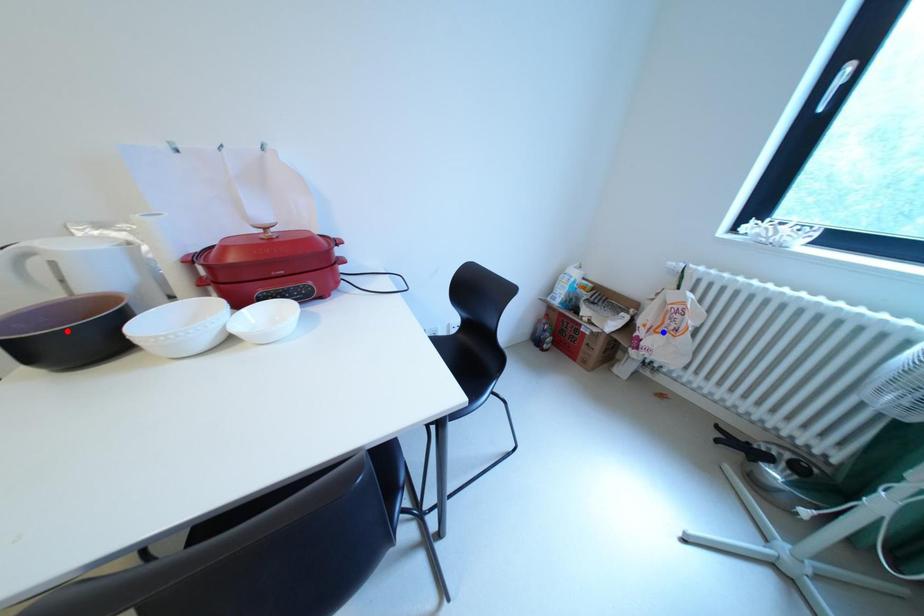
Question: In the image, two points are highlighted. Which point is nearer to the camera? Reply with the corresponding letter.

Choices:
 (A) blue point
 (B) red point

Answer: (B)